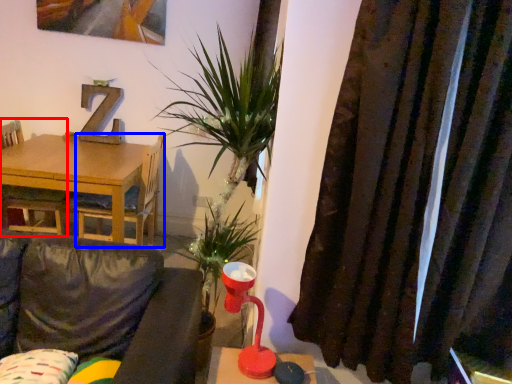
Question: Among these objects, which one is farthest to the camera, chair (highlighted by a red box) or chair (highlighted by a blue box)?

Choices:
 (A) chair
 (B) chair

Answer: (A)